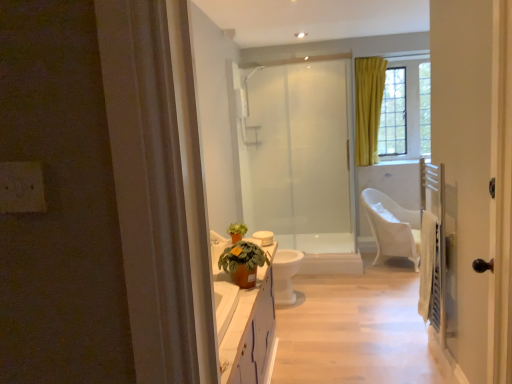
Question: From a real-world perspective, is frosted glass shower door at center above or below yellow fabric curtain at upper right?

Choices:
 (A) above
 (B) below

Answer: (B)

Question: In terms of width, does frosted glass shower door at center look wider or thinner when compared to yellow fabric curtain at upper right?

Choices:
 (A) wide
 (B) thin

Answer: (B)

Question: Estimate the real-world distances between objects in this image. Which object is closer to the white glossy toilet bowl at center?

Choices:
 (A) frosted glass shower door at center
 (B) white glossy door at right
 (C) yellow fabric curtain at upper right
 (D) terracotta clay pot at center
 (E) white plastic chair at right

Answer: (A)

Question: Which is farther from the white glossy toilet bowl at center?

Choices:
 (A) terracotta clay pot at center
 (B) yellow fabric curtain at upper right
 (C) frosted glass shower door at center
 (D) white plastic chair at right
 (E) white glossy door at right

Answer: (B)